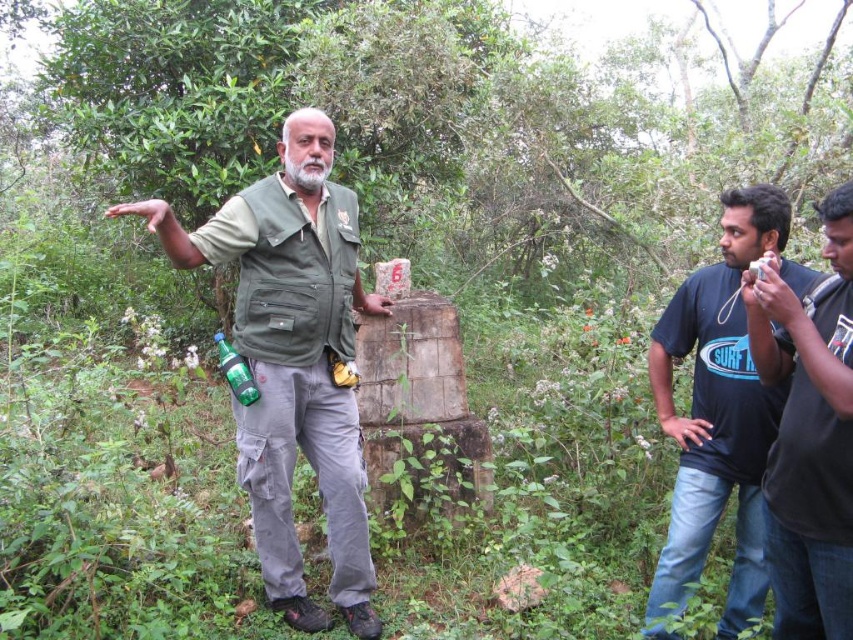
You are a photographer positioned behind the central figure in the forest scene. You want to capture a clear shot of both the green matte vest at center and the green glass bottle at center. Which object should you focus on first to ensure both are in focus?

The green matte vest at center is closer to the viewer than the green glass bottle at center. To ensure both are in focus, you should focus on the green glass bottle at center first, as it is farther away, allowing the depth of field to cover the closer vest.